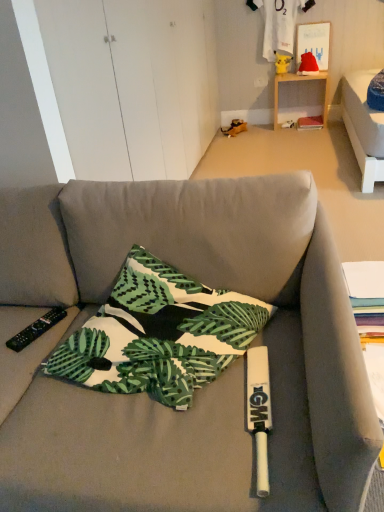
Question: Does black plastic remote control at lower left come in front of white cotton t-shirt at upper center?

Choices:
 (A) no
 (B) yes

Answer: (B)

Question: Is white cotton t-shirt at upper center inside black plastic remote control at lower left?

Choices:
 (A) yes
 (B) no

Answer: (B)

Question: Is black plastic remote control at lower left completely or partially outside of white cotton t-shirt at upper center?

Choices:
 (A) no
 (B) yes

Answer: (B)

Question: From a real-world perspective, is black plastic remote control at lower left located beneath white cotton t-shirt at upper center?

Choices:
 (A) no
 (B) yes

Answer: (B)

Question: Considering the relative sizes of black plastic remote control at lower left and white cotton t-shirt at upper center in the image provided, is black plastic remote control at lower left bigger than white cotton t-shirt at upper center?

Choices:
 (A) no
 (B) yes

Answer: (A)

Question: Is black plastic remote control at lower left not near white cotton t-shirt at upper center?

Choices:
 (A) no
 (B) yes

Answer: (B)

Question: Does printed fabric pillow at center turn towards white cotton t-shirt at upper center?

Choices:
 (A) yes
 (B) no

Answer: (B)

Question: Is printed fabric pillow at center positioned with its back to white cotton t-shirt at upper center?

Choices:
 (A) no
 (B) yes

Answer: (B)

Question: Considering the relative positions of printed fabric pillow at center and white cotton t-shirt at upper center in the image provided, is printed fabric pillow at center to the left of white cotton t-shirt at upper center from the viewer's perspective?

Choices:
 (A) no
 (B) yes

Answer: (B)

Question: Is printed fabric pillow at center wider than white cotton t-shirt at upper center?

Choices:
 (A) yes
 (B) no

Answer: (A)

Question: Does printed fabric pillow at center have a smaller size compared to white cotton t-shirt at upper center?

Choices:
 (A) no
 (B) yes

Answer: (A)

Question: From the image's perspective, is printed fabric pillow at center on top of white cotton t-shirt at upper center?

Choices:
 (A) yes
 (B) no

Answer: (B)

Question: Can you confirm if white cotton t-shirt at upper center is smaller than printed fabric pillow at center?

Choices:
 (A) no
 (B) yes

Answer: (B)